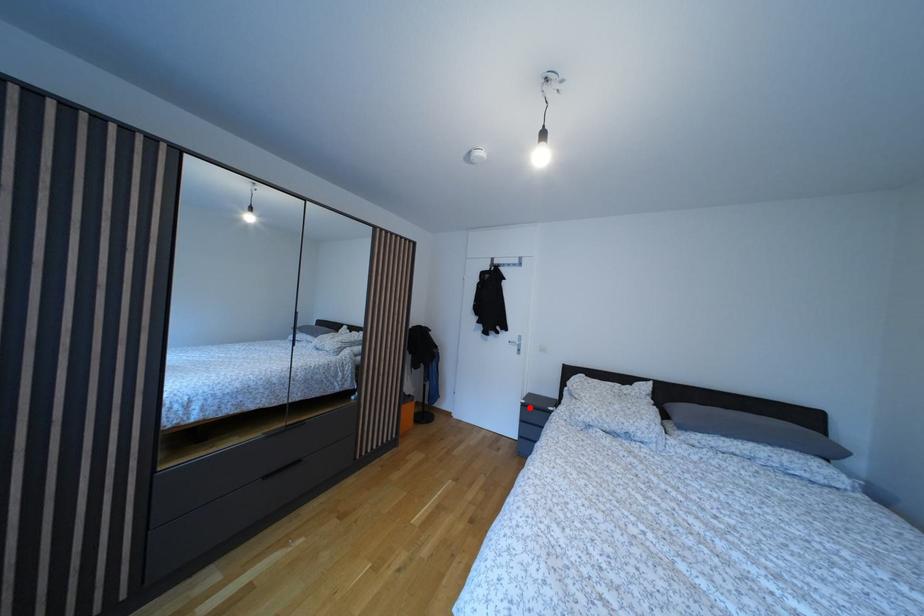
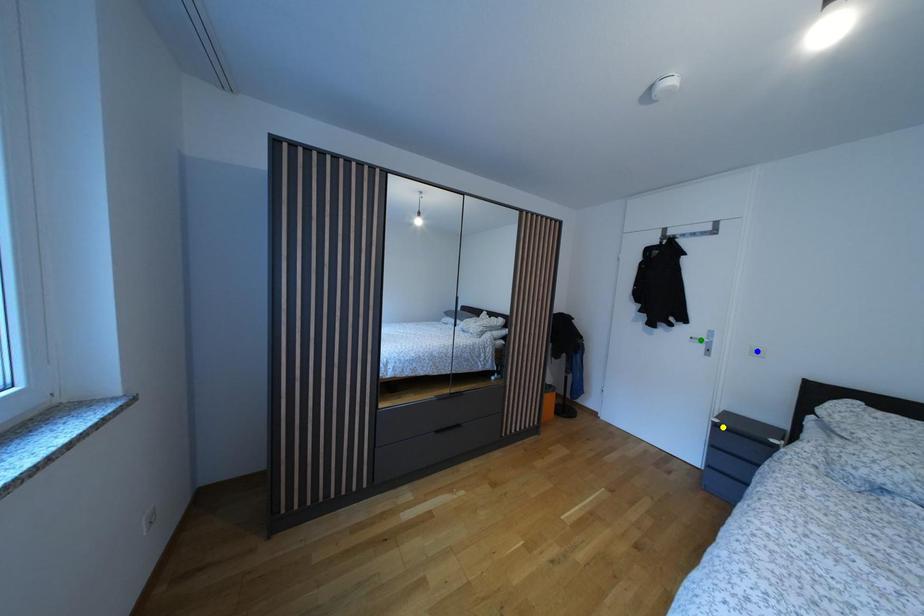
Question: I am providing you with two images of the same scene from different viewpoints. A red point is marked on the first image. You are given multiple points on the second image. Which mark in image 2 goes with the point in image 1?

Choices:
 (A) yellow point
 (B) green point
 (C) blue point

Answer: (A)